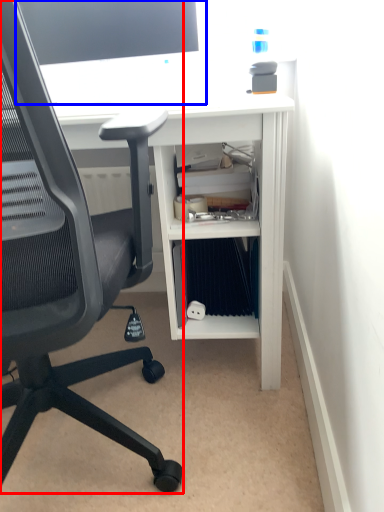
Question: Which point is closer to the camera, chair (highlighted by a red box) or desktop computer (highlighted by a blue box)?

Choices:
 (A) chair
 (B) desktop computer

Answer: (A)